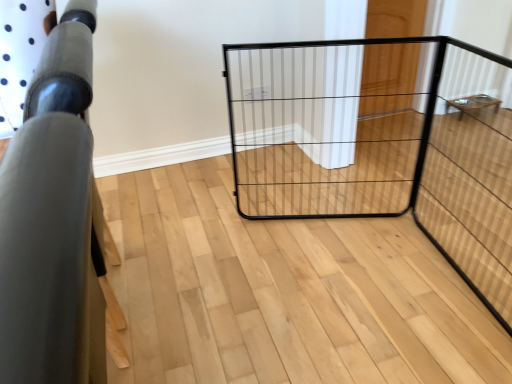
Measure the distance between point (20, 270) and camera.

Point (20, 270) and camera are 8.98 inches apart from each other.

The width and height of the screenshot is (512, 384). Identify the location of wooden table at right, the first furniture in the top-to-bottom sequence. point(472,103).

Is wooden door at upper right taller or shorter than wooden table at right, positioned as the second furniture in front-to-back order?

In the image, wooden door at upper right appears to be taller than wooden table at right, positioned as the second furniture in front-to-back order.

There is a wooden door at upper right. Identify the location of the 1st furniture below it (from the image's perspective). Image resolution: width=512 pixels, height=384 pixels. (472, 103).

Considering the relative sizes of wooden door at upper right and wooden table at right, positioned as the second furniture in front-to-back order, in the image provided, is wooden door at upper right wider than wooden table at right, positioned as the second furniture in front-to-back order,?

Incorrect, the width of wooden door at upper right does not surpass that of wooden table at right, positioned as the second furniture in front-to-back order.

Which of these two, wooden door at upper right or wooden table at right, the first furniture in the top-to-bottom sequence, is bigger?

Bigger between the two is wooden door at upper right.

Does wooden table at right, the second furniture positioned from the bottom, have a smaller size compared to matte black railing at left, the 1th furniture when ordered from bottom to top?

Indeed, wooden table at right, the second furniture positioned from the bottom, has a smaller size compared to matte black railing at left, the 1th furniture when ordered from bottom to top.

Is wooden table at right, positioned as the second furniture in front-to-back order, taller or shorter than matte black railing at left, positioned as the 2th furniture in back-to-front order?

wooden table at right, positioned as the second furniture in front-to-back order, is shorter than matte black railing at left, positioned as the 2th furniture in back-to-front order.

Is wooden table at right, marked as the first furniture in a right-to-left arrangement, turned away from matte black railing at left, which ranks as the 1th furniture in front-to-back order?

That's not correct — wooden table at right, marked as the first furniture in a right-to-left arrangement, is not looking away from matte black railing at left, which ranks as the 1th furniture in front-to-back order.

Considering the positions of objects wooden table at right, positioned as the second furniture in front-to-back order, and matte black railing at left, which appears as the second furniture when viewed from the top, in the image provided, who is in front, wooden table at right, positioned as the second furniture in front-to-back order, or matte black railing at left, which appears as the second furniture when viewed from the top,?

matte black railing at left, which appears as the second furniture when viewed from the top.

Which of these two, black wire cage at center or matte black railing at left, which appears as the second furniture when viewed from the top, stands taller?

With more height is matte black railing at left, which appears as the second furniture when viewed from the top.

Consider the image. From a real-world perspective, is black wire cage at center under matte black railing at left, the 1th furniture when ordered from bottom to top?

Indeed, from a real-world perspective, black wire cage at center is positioned beneath matte black railing at left, the 1th furniture when ordered from bottom to top.

Would you consider black wire cage at center to be distant from matte black railing at left, positioned as the 2th furniture in back-to-front order?

Yes, black wire cage at center is far from matte black railing at left, positioned as the 2th furniture in back-to-front order.

Is matte black railing at left, positioned as the 2th furniture in back-to-front order, a part of black wire cage at center?

No, black wire cage at center does not contain matte black railing at left, positioned as the 2th furniture in back-to-front order.

How much distance is there between black wire cage at center and wooden table at right, positioned as the 1th furniture in back-to-front order?

32.93 inches.

In the scene shown: Does black wire cage at center lie behind wooden table at right, the second furniture positioned from the bottom?

No, it is in front of wooden table at right, the second furniture positioned from the bottom.

Is black wire cage at center shorter than wooden table at right, the second furniture positioned from the bottom?

No, black wire cage at center is not shorter than wooden table at right, the second furniture positioned from the bottom.

From a real-world perspective, which object rests below the other?

In real-world perspective, wooden table at right, positioned as the second furniture in front-to-back order, is lower.

Are matte black railing at left, which appears as the second furniture when viewed from the top, and wooden table at right, marked as the first furniture in a right-to-left arrangement, far apart?

Yes.

From a real-world perspective, is matte black railing at left, positioned as the 2th furniture in back-to-front order, beneath wooden table at right, the first furniture in the top-to-bottom sequence?

Actually, matte black railing at left, positioned as the 2th furniture in back-to-front order, is physically above wooden table at right, the first furniture in the top-to-bottom sequence, in the real world.

Which of these two, matte black railing at left, which ranks as the 1th furniture in front-to-back order, or wooden table at right, marked as the first furniture in a right-to-left arrangement, is thinner?

wooden table at right, marked as the first furniture in a right-to-left arrangement, is thinner.

Looking at this image, is matte black railing at left, the 1th furniture when ordered from bottom to top, oriented away from wooden table at right, marked as the first furniture in a right-to-left arrangement?

No, matte black railing at left, the 1th furniture when ordered from bottom to top, is not facing away from wooden table at right, marked as the first furniture in a right-to-left arrangement.

Is there a large distance between wooden door at upper right and matte black railing at left, the 1th furniture when ordered from bottom to top?

That's right, there is a large distance between wooden door at upper right and matte black railing at left, the 1th furniture when ordered from bottom to top.

Considering the points (391, 23) and (54, 136), which point is behind, point (391, 23) or point (54, 136)?

The point (391, 23) is more distant.

Considering the sizes of objects wooden door at upper right and matte black railing at left, which ranks as the 1th furniture in front-to-back order, in the image provided, who is wider, wooden door at upper right or matte black railing at left, which ranks as the 1th furniture in front-to-back order,?

matte black railing at left, which ranks as the 1th furniture in front-to-back order, is wider.

The height and width of the screenshot is (384, 512). Find the location of `door to the left of wooden table at right, marked as the second furniture in a left-to-right arrangement`. door to the left of wooden table at right, marked as the second furniture in a left-to-right arrangement is located at coordinates (388, 78).

Is wooden door at upper right surrounded by wooden table at right, marked as the first furniture in a right-to-left arrangement?

No, wooden door at upper right is not a part of wooden table at right, marked as the first furniture in a right-to-left arrangement.

Consider the image. Which object is positioned more to the right, wooden table at right, the first furniture in the top-to-bottom sequence, or wooden door at upper right?

wooden table at right, the first furniture in the top-to-bottom sequence, is more to the right.

Relative to wooden door at upper right, is wooden table at right, positioned as the second furniture in front-to-back order, in front or behind?

wooden table at right, positioned as the second furniture in front-to-back order, is positioned farther from the viewer than wooden door at upper right.

You are a GUI agent. You are given a task and a screenshot of the screen. Output one action in this format:
    pyautogui.click(x=<x>, y=<y>)
    Task: Click on the door in front of the wooden table at right, the first furniture in the top-to-bottom sequence
    The image size is (512, 384).
    Given the screenshot: What is the action you would take?
    pyautogui.click(x=388, y=78)

At what (x,y) coordinates should I click in order to perform the action: click on furniture that appears below the matte black railing at left, which appears as the second furniture when viewed from the right (from a real-world perspective). Please return your answer as a coordinate pair (x, y). The image size is (512, 384). Looking at the image, I should click on (472, 103).

Based on the photo, estimate the real-world distances between objects in this image. Which object is further from wooden table at right, the second furniture positioned from the bottom, matte black railing at left, the 1th furniture when ordered from bottom to top, or wooden door at upper right?

Among the two, matte black railing at left, the 1th furniture when ordered from bottom to top, is located further to wooden table at right, the second furniture positioned from the bottom.

When comparing their distances from wooden table at right, positioned as the 1th furniture in back-to-front order, does wooden door at upper right or matte black railing at left, which appears as the second furniture when viewed from the right, seem further?

Based on the image, matte black railing at left, which appears as the second furniture when viewed from the right, appears to be further to wooden table at right, positioned as the 1th furniture in back-to-front order.

Which object lies further to the anchor point wooden door at upper right, matte black railing at left, which ranks as the first furniture in left-to-right order, or black wire cage at center?

matte black railing at left, which ranks as the first furniture in left-to-right order.

Which object lies further to the anchor point wooden door at upper right, matte black railing at left, which appears as the second furniture when viewed from the right, or wooden table at right, the first furniture in the top-to-bottom sequence?

Based on the image, matte black railing at left, which appears as the second furniture when viewed from the right, appears to be further to wooden door at upper right.

Which object lies nearer to the anchor point wooden door at upper right, black wire cage at center or matte black railing at left, which appears as the second furniture when viewed from the right?

Among the two, black wire cage at center is located nearer to wooden door at upper right.

Looking at this image, when comparing their distances from wooden table at right, marked as the first furniture in a right-to-left arrangement, does wooden door at upper right or black wire cage at center seem further?

black wire cage at center lies further to wooden table at right, marked as the first furniture in a right-to-left arrangement, than the other object.

From the image, which object appears to be nearer to black wire cage at center, matte black railing at left, which appears as the second furniture when viewed from the right, or wooden door at upper right?

wooden door at upper right is closer to black wire cage at center.

Based on their spatial positions, is wooden table at right, positioned as the 1th furniture in back-to-front order, or wooden door at upper right further from black wire cage at center?

Based on the image, wooden table at right, positioned as the 1th furniture in back-to-front order, appears to be further to black wire cage at center.

The image size is (512, 384). Find the location of `cage between matte black railing at left, positioned as the 2th furniture in back-to-front order, and wooden door at upper right in the front-back direction`. cage between matte black railing at left, positioned as the 2th furniture in back-to-front order, and wooden door at upper right in the front-back direction is located at coordinates (379, 143).

What are the coordinates of `door between matte black railing at left, which ranks as the first furniture in left-to-right order, and wooden table at right, the second furniture positioned from the bottom, from left to right` in the screenshot? It's located at (388, 78).

I want to click on cage located between matte black railing at left, which appears as the second furniture when viewed from the top, and wooden table at right, the second furniture positioned from the bottom, in the left-right direction, so [379, 143].

I want to click on door positioned between black wire cage at center and wooden table at right, marked as the second furniture in a left-to-right arrangement, from near to far, so click(x=388, y=78).